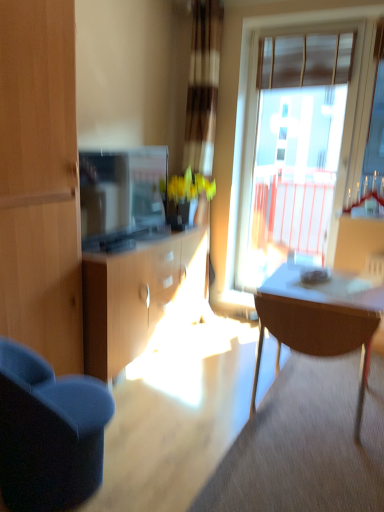
Question: Is translucent glass window at upper right aimed at matte brown table at right?

Choices:
 (A) yes
 (B) no

Answer: (A)

Question: Is translucent glass window at upper right closer to the viewer compared to matte brown table at right?

Choices:
 (A) yes
 (B) no

Answer: (B)

Question: Does translucent glass window at upper right have a lesser height compared to matte brown table at right?

Choices:
 (A) no
 (B) yes

Answer: (A)

Question: Considering the relative positions of translucent glass window at upper right and matte brown table at right in the image provided, is translucent glass window at upper right behind matte brown table at right?

Choices:
 (A) yes
 (B) no

Answer: (A)

Question: From the image's perspective, is translucent glass window at upper right under matte brown table at right?

Choices:
 (A) yes
 (B) no

Answer: (B)

Question: Considering the relative positions of translucent glass window at upper right and matte brown table at right in the image provided, is translucent glass window at upper right to the right of matte brown table at right from the viewer's perspective?

Choices:
 (A) yes
 (B) no

Answer: (A)

Question: Can you confirm if matte brown table at right is positioned to the left of translucent glass window at upper right?

Choices:
 (A) yes
 (B) no

Answer: (A)

Question: Considering the relative sizes of matte brown table at right and translucent glass window at upper right in the image provided, is matte brown table at right bigger than translucent glass window at upper right?

Choices:
 (A) yes
 (B) no

Answer: (A)

Question: Does matte brown table at right turn towards translucent glass window at upper right?

Choices:
 (A) yes
 (B) no

Answer: (B)

Question: From a real-world perspective, is matte brown table at right positioned under translucent glass window at upper right based on gravity?

Choices:
 (A) no
 (B) yes

Answer: (B)

Question: Are matte brown table at right and translucent glass window at upper right far apart?

Choices:
 (A) yes
 (B) no

Answer: (A)

Question: Can you confirm if matte brown table at right is taller than translucent glass window at upper right?

Choices:
 (A) yes
 (B) no

Answer: (B)

Question: Is translucent glass window at upper right taller or shorter than matte brown table at right?

Choices:
 (A) short
 (B) tall

Answer: (B)